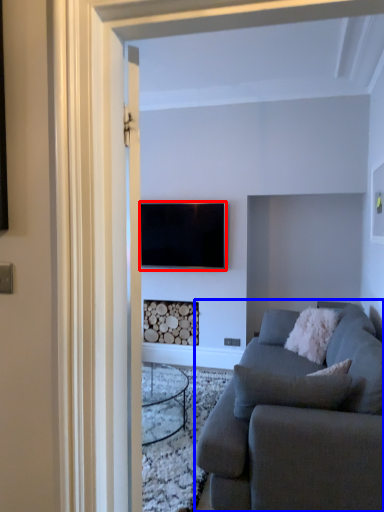
Question: Among these objects, which one is farthest to the camera, television (highlighted by a red box) or studio couch (highlighted by a blue box)?

Choices:
 (A) television
 (B) studio couch

Answer: (A)